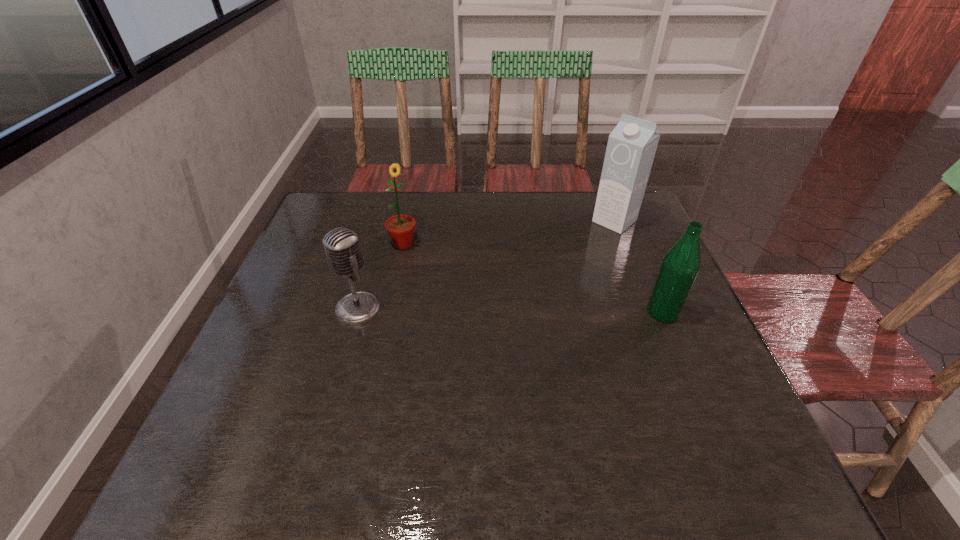
Where is `microphone`? This screenshot has height=540, width=960. microphone is located at coordinates (342, 247).

The image size is (960, 540). I want to click on bottle, so click(x=680, y=265).

The width and height of the screenshot is (960, 540). In order to click on sunflower in this screenshot , I will do `click(401, 228)`.

You are a GUI agent. You are given a task and a screenshot of the screen. Output one action in this format:
    pyautogui.click(x=<x>, y=<y>)
    Task: Click on the farthest object
    
    Given the screenshot: What is the action you would take?
    pyautogui.click(x=631, y=147)

Locate an element on the screen. The image size is (960, 540). the tallest object is located at coordinates (631, 147).

The image size is (960, 540). I want to click on free space located on the back of the microphone, so click(377, 240).

At what (x,y) coordinates should I click in order to perform the action: click on vacant space located 0.130m on the front of the bottle. Please return your answer as a coordinate pair (x, y). Looking at the image, I should click on (687, 371).

You are a GUI agent. You are given a task and a screenshot of the screen. Output one action in this format:
    pyautogui.click(x=<x>, y=<y>)
    Task: Click on the vacant area located on the face of the sunflower
    
    Given the screenshot: What is the action you would take?
    pyautogui.click(x=498, y=334)

The height and width of the screenshot is (540, 960). I want to click on vacant space situated 0.290m on the face of the sunflower, so click(x=474, y=311).

Identify the location of vacant area situated 0.310m on the face of the sunflower. The image size is (960, 540). (479, 316).